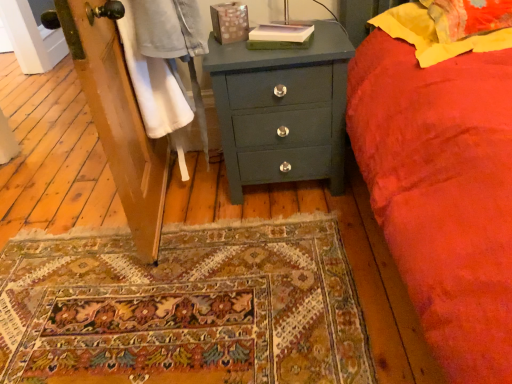
Describe the element at coordinates (282, 110) in the screenshot. This screenshot has height=384, width=512. I see `matte green chest of drawers at center` at that location.

Describe the element at coordinates (468, 17) in the screenshot. This screenshot has height=384, width=512. I see `yellow fabric pillow at upper right, arranged as the second pillow when ordered from the bottom` at that location.

Where is `yellow fabric pillow at upper right, which appears as the 1th pillow when ordered from the bottom`? yellow fabric pillow at upper right, which appears as the 1th pillow when ordered from the bottom is located at coordinates (434, 35).

Is matte green chest of drawers at center located outside yellow fabric pillow at upper right, arranged as the second pillow when ordered from the bottom?

Absolutely, matte green chest of drawers at center is external to yellow fabric pillow at upper right, arranged as the second pillow when ordered from the bottom.

Which object is closer to the camera taking this photo, matte green chest of drawers at center or yellow fabric pillow at upper right, arranged as the second pillow when ordered from the bottom?

yellow fabric pillow at upper right, arranged as the second pillow when ordered from the bottom, is more forward.

Is matte green chest of drawers at center positioned far away from yellow fabric pillow at upper right, arranged as the second pillow when ordered from the bottom?

No.

Between matte green chest of drawers at center and yellow fabric pillow at upper right, which appears as the 1th pillow when ordered from the bottom, which one appears on the left side from the viewer's perspective?

matte green chest of drawers at center.

Based on their sizes in the image, would you say matte green chest of drawers at center is bigger or smaller than yellow fabric pillow at upper right, which appears as the 1th pillow when ordered from the bottom?

Considering their sizes, matte green chest of drawers at center takes up more space than yellow fabric pillow at upper right, which appears as the 1th pillow when ordered from the bottom.

Is matte green chest of drawers at center spatially inside yellow fabric pillow at upper right, the 2th pillow viewed from the top, or outside of it?

matte green chest of drawers at center is outside yellow fabric pillow at upper right, the 2th pillow viewed from the top.

From their relative heights in the image, would you say matte green chest of drawers at center is taller or shorter than yellow fabric pillow at upper right, the 2th pillow viewed from the top?

Considering their sizes, matte green chest of drawers at center has more height than yellow fabric pillow at upper right, the 2th pillow viewed from the top.

Locate an element on the screen. The width and height of the screenshot is (512, 384). pillow on the left of yellow fabric pillow at upper right, arranged as the second pillow when ordered from the bottom is located at coordinates (434, 35).

From their relative heights in the image, would you say yellow fabric pillow at upper right, which appears as the 1th pillow when ordered from the bottom, is taller or shorter than yellow fabric pillow at upper right, which is the first pillow from top to bottom?

In the image, yellow fabric pillow at upper right, which appears as the 1th pillow when ordered from the bottom, appears to be shorter than yellow fabric pillow at upper right, which is the first pillow from top to bottom.

Does yellow fabric pillow at upper right, which appears as the 1th pillow when ordered from the bottom, lie in front of yellow fabric pillow at upper right, which is the first pillow from top to bottom?

Yes, it is in front of yellow fabric pillow at upper right, which is the first pillow from top to bottom.

How much distance is there between yellow fabric pillow at upper right, which appears as the 1th pillow when ordered from the bottom, and yellow fabric pillow at upper right, which is the first pillow from top to bottom?

yellow fabric pillow at upper right, which appears as the 1th pillow when ordered from the bottom, is 2.95 inches away from yellow fabric pillow at upper right, which is the first pillow from top to bottom.

Considering their positions, is yellow fabric pillow at upper right, arranged as the second pillow when ordered from the bottom, located in front of or behind matte green chest of drawers at center?

yellow fabric pillow at upper right, arranged as the second pillow when ordered from the bottom, is in front of matte green chest of drawers at center.

From a real-world perspective, is yellow fabric pillow at upper right, which is the first pillow from top to bottom, physically located above or below matte green chest of drawers at center?

From a real-world perspective, yellow fabric pillow at upper right, which is the first pillow from top to bottom, is physically above matte green chest of drawers at center.

Considering the sizes of objects yellow fabric pillow at upper right, arranged as the second pillow when ordered from the bottom, and matte green chest of drawers at center in the image provided, who is shorter, yellow fabric pillow at upper right, arranged as the second pillow when ordered from the bottom, or matte green chest of drawers at center?

Standing shorter between the two is yellow fabric pillow at upper right, arranged as the second pillow when ordered from the bottom.

Can matte green chest of drawers at center be found inside yellow fabric pillow at upper right, arranged as the second pillow when ordered from the bottom?

No, matte green chest of drawers at center is not inside yellow fabric pillow at upper right, arranged as the second pillow when ordered from the bottom.

Would you say yellow fabric pillow at upper right, the 2th pillow viewed from the top, is outside matte green chest of drawers at center?

Yes, yellow fabric pillow at upper right, the 2th pillow viewed from the top, is not within matte green chest of drawers at center.

Who is shorter, yellow fabric pillow at upper right, which appears as the 1th pillow when ordered from the bottom, or matte green chest of drawers at center?

Standing shorter between the two is yellow fabric pillow at upper right, which appears as the 1th pillow when ordered from the bottom.

Could you measure the distance between yellow fabric pillow at upper right, which appears as the 1th pillow when ordered from the bottom, and matte green chest of drawers at center?

18.00 inches.

Does yellow fabric pillow at upper right, the 2th pillow viewed from the top, have a larger size compared to matte green chest of drawers at center?

Actually, yellow fabric pillow at upper right, the 2th pillow viewed from the top, might be smaller than matte green chest of drawers at center.

Is the position of yellow fabric pillow at upper right, which is the first pillow from top to bottom, less distant than that of yellow fabric pillow at upper right, which appears as the 1th pillow when ordered from the bottom?

No, the depth of yellow fabric pillow at upper right, which is the first pillow from top to bottom, is greater than that of yellow fabric pillow at upper right, which appears as the 1th pillow when ordered from the bottom.

Is yellow fabric pillow at upper right, which is the first pillow from top to bottom, thinner than yellow fabric pillow at upper right, which appears as the 1th pillow when ordered from the bottom?

Yes.

From a real-world perspective, between yellow fabric pillow at upper right, arranged as the second pillow when ordered from the bottom, and yellow fabric pillow at upper right, which appears as the 1th pillow when ordered from the bottom, who is vertically higher?

yellow fabric pillow at upper right, arranged as the second pillow when ordered from the bottom, from a real-world perspective.

The image size is (512, 384). There is a matte green chest of drawers at center. Identify the location of the 2nd pillow above it (from the image's perspective). pos(468,17).

This screenshot has height=384, width=512. Find the location of `chest of drawers behind the yellow fabric pillow at upper right, the 2th pillow viewed from the top`. chest of drawers behind the yellow fabric pillow at upper right, the 2th pillow viewed from the top is located at coordinates (282, 110).

Considering their positions, is yellow fabric pillow at upper right, which appears as the 1th pillow when ordered from the bottom, positioned closer to yellow fabric pillow at upper right, arranged as the second pillow when ordered from the bottom, than matte green chest of drawers at center?

The object closer to yellow fabric pillow at upper right, arranged as the second pillow when ordered from the bottom, is yellow fabric pillow at upper right, which appears as the 1th pillow when ordered from the bottom.

When comparing their distances from matte green chest of drawers at center, does yellow fabric pillow at upper right, which is the first pillow from top to bottom, or yellow fabric pillow at upper right, the 2th pillow viewed from the top, seem further?

Based on the image, yellow fabric pillow at upper right, which is the first pillow from top to bottom, appears to be further to matte green chest of drawers at center.

Considering their positions, is yellow fabric pillow at upper right, arranged as the second pillow when ordered from the bottom, positioned further to yellow fabric pillow at upper right, which appears as the 1th pillow when ordered from the bottom, than matte green chest of drawers at center?

matte green chest of drawers at center.

From the picture: Considering their positions, is matte green chest of drawers at center positioned further to yellow fabric pillow at upper right, which is the first pillow from top to bottom, than yellow fabric pillow at upper right, the 2th pillow viewed from the top?

Among the two, matte green chest of drawers at center is located further to yellow fabric pillow at upper right, which is the first pillow from top to bottom.

When comparing their distances from matte green chest of drawers at center, does yellow fabric pillow at upper right, which appears as the 1th pillow when ordered from the bottom, or yellow fabric pillow at upper right, which is the first pillow from top to bottom, seem closer?

yellow fabric pillow at upper right, which appears as the 1th pillow when ordered from the bottom, lies closer to matte green chest of drawers at center than the other object.

Looking at the image, which one is located further to yellow fabric pillow at upper right, the 2th pillow viewed from the top, matte green chest of drawers at center or yellow fabric pillow at upper right, which is the first pillow from top to bottom?

matte green chest of drawers at center is positioned further to the anchor yellow fabric pillow at upper right, the 2th pillow viewed from the top.

At what (x,y) coordinates should I click in order to perform the action: click on pillow situated between matte green chest of drawers at center and yellow fabric pillow at upper right, which is the first pillow from top to bottom, from left to right. Please return your answer as a coordinate pair (x, y). The height and width of the screenshot is (384, 512). Looking at the image, I should click on (434, 35).